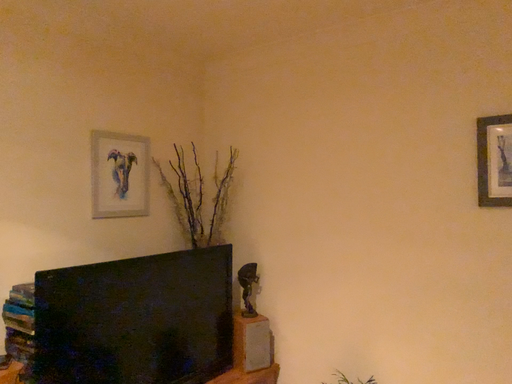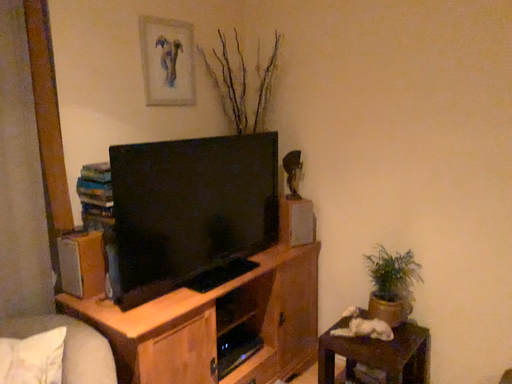
Question: How did the camera likely rotate when shooting the video?

Choices:
 (A) rotated downward
 (B) rotated upward

Answer: (A)